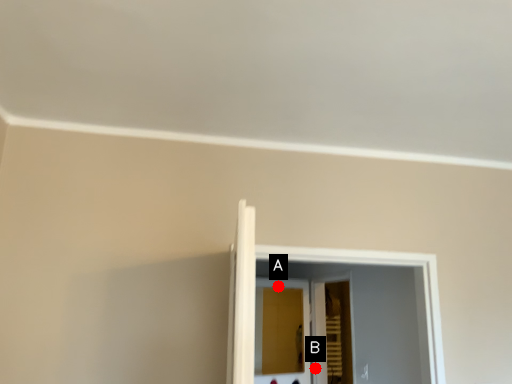
Question: Two points are circled on the image, labeled by A and B beside each circle. Which of the following is the closest to the observer?

Choices:
 (A) A is closer
 (B) B is closer

Answer: (B)